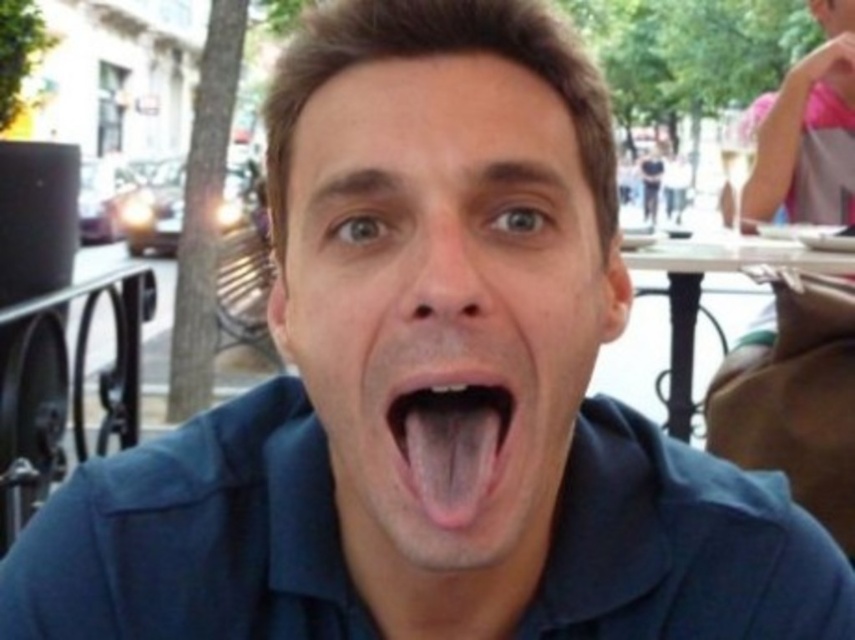
You are a photographer using a camera with a focal length of 50mm. You want to capture a portrait of the matte blue face at center while ensuring the subject is in focus. Given that the minimum focusing distance for your camera at this focal length is 14 inches, will you be able to take the photo without moving closer?

The matte blue face at center is 14.51 inches away from the viewer. Since the minimum focusing distance of the camera is 14 inches, the distance of 14.51 inches is slightly beyond the minimum requirement. Therefore, the photographer can take the photo without moving closer as the camera can focus at that distance.